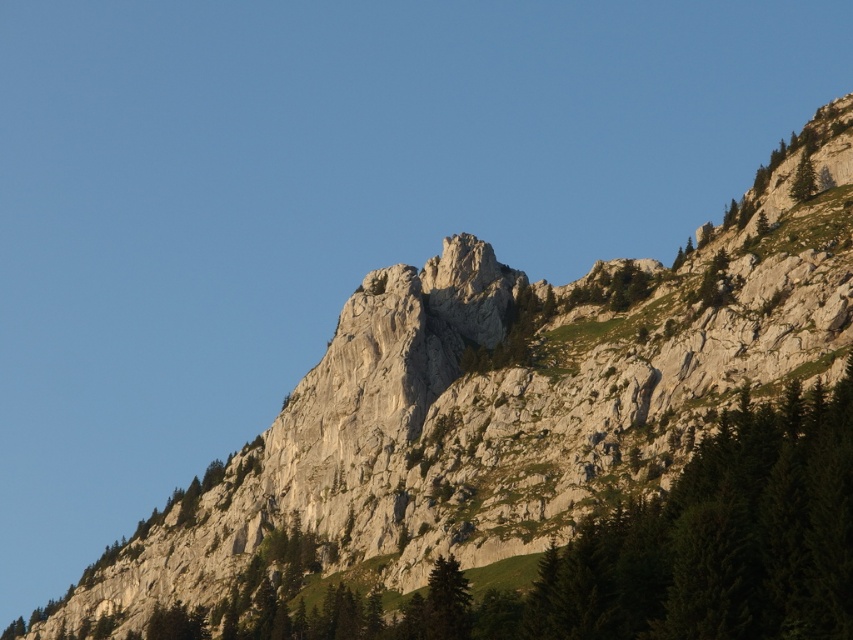
Question: Among these points, which one is nearest to the camera?

Choices:
 (A) (447, 628)
 (B) (799, 172)

Answer: (A)

Question: Where is green matte tree at lower center located in relation to green textured tree at upper right in the image?

Choices:
 (A) below
 (B) above

Answer: (A)

Question: Which of the following is the closest to the observer?

Choices:
 (A) green matte tree at lower center
 (B) green textured tree at upper right

Answer: (A)

Question: Can you confirm if green matte tree at lower center is positioned to the left of green textured tree at upper right?

Choices:
 (A) yes
 (B) no

Answer: (A)

Question: Considering the relative positions of green matte tree at lower center and green textured tree at upper right in the image provided, where is green matte tree at lower center located with respect to green textured tree at upper right?

Choices:
 (A) above
 (B) below

Answer: (B)